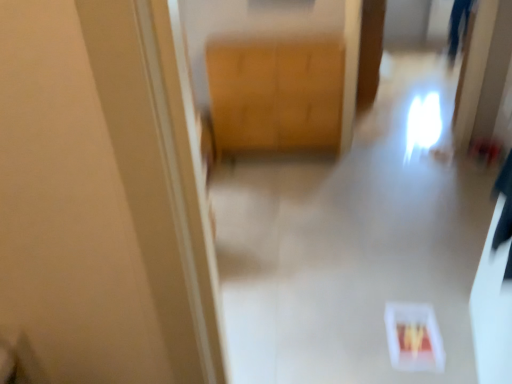
In order to click on vacant area situated below wooden cabinet at center (from a real-world perspective) in this screenshot , I will do `click(279, 157)`.